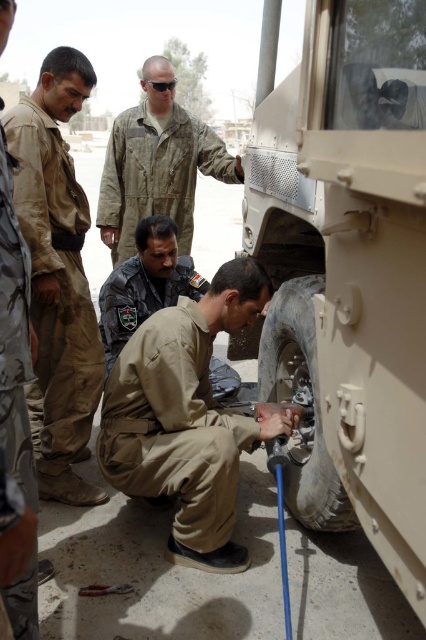
Based on the scene description, where is the camouflage fabric uniform at upper center located in terms of coordinates?

The camouflage fabric uniform at upper center is located at coordinates point (157, 164).

You are standing at the camera position and want to reach the point marked at coordinates (132, 243). If you have a 5 meter long rope, will it be sufficient to reach that point?

The point marked at coordinates (132, 243) is 4.08 meters away from the camera. Since the rope is 5 meters long, which is longer than the distance, it will be sufficient to reach the point.